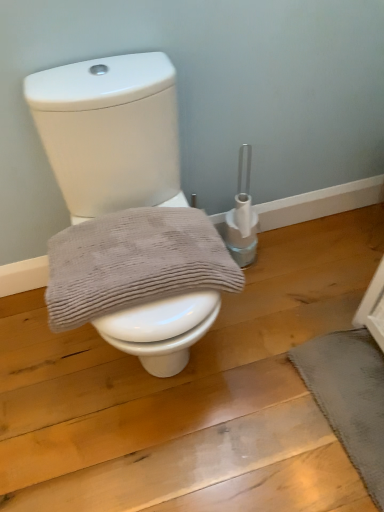
Question: Does point (342, 348) appear closer or farther from the camera than point (168, 111)?

Choices:
 (A) farther
 (B) closer

Answer: (A)

Question: Is dark gray textured bath mat at lower right wider or thinner than white glossy toilet at center?

Choices:
 (A) thin
 (B) wide

Answer: (A)

Question: Which is farther from the gray textured towel at center?

Choices:
 (A) white glossy toilet at center
 (B) dark gray textured bath mat at lower right

Answer: (B)

Question: Estimate the real-world distances between objects in this image. Which object is farther from the white glossy toilet at center?

Choices:
 (A) gray textured towel at center
 (B) dark gray textured bath mat at lower right

Answer: (B)